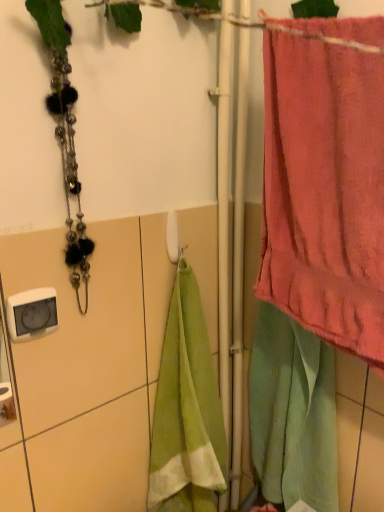
Describe the element at coordinates (173, 238) in the screenshot. This screenshot has height=512, width=384. I see `white plastic towel bar at center` at that location.

Locate an element on the screen. This screenshot has height=512, width=384. white plastic towel bar at center is located at coordinates (173, 238).

What do you see at coordinates (325, 179) in the screenshot? This screenshot has width=384, height=512. I see `pink terry cloth towel at right` at bounding box center [325, 179].

The height and width of the screenshot is (512, 384). Identify the location of pink terry cloth towel at right. (325, 179).

Identify the location of white plastic towel bar at center. (173, 238).

Is pink terry cloth towel at right to the left of white plastic towel bar at center from the viewer's perspective?

Incorrect, pink terry cloth towel at right is not on the left side of white plastic towel bar at center.

Is pink terry cloth towel at right in front of or behind white plastic towel bar at center in the image?

Visually, pink terry cloth towel at right is located in front of white plastic towel bar at center.

Is point (377, 361) positioned after point (177, 239)?

No, (377, 361) is in front of (177, 239).

In the scene shown: From the image's perspective, which object appears higher, pink terry cloth towel at right or white plastic towel bar at center?

pink terry cloth towel at right, from the image's perspective.

From a real-world perspective, is pink terry cloth towel at right located beneath white plastic towel bar at center?

No.

In terms of width, does pink terry cloth towel at right look wider or thinner when compared to white plastic towel bar at center?

pink terry cloth towel at right is wider than white plastic towel bar at center.

From their relative heights in the image, would you say pink terry cloth towel at right is taller or shorter than white plastic towel bar at center?

Considering their sizes, pink terry cloth towel at right has more height than white plastic towel bar at center.

Is pink terry cloth towel at right bigger or smaller than white plastic towel bar at center?

Considering their sizes, pink terry cloth towel at right takes up more space than white plastic towel bar at center.

Is pink terry cloth towel at right positioned beyond the bounds of white plastic towel bar at center?

Indeed, pink terry cloth towel at right is completely outside white plastic towel bar at center.

Is pink terry cloth towel at right placed right next to white plastic towel bar at center?

pink terry cloth towel at right and white plastic towel bar at center are not in contact.

Is pink terry cloth towel at right turned away from white plastic towel bar at center?

No, pink terry cloth towel at right's orientation is not away from white plastic towel bar at center.

How different are the orientations of pink terry cloth towel at right and white plastic towel bar at center in degrees?

90 degrees separate the facing orientations of pink terry cloth towel at right and white plastic towel bar at center.

At what (x,y) coordinates should I click in order to perform the action: click on towel above the white plastic towel bar at center (from the image's perspective). Please return your answer as a coordinate pair (x, y). This screenshot has width=384, height=512. Looking at the image, I should click on (325, 179).

Considering the positions of objects white plastic towel bar at center and pink terry cloth towel at right in the image provided, who is more to the left, white plastic towel bar at center or pink terry cloth towel at right?

From the viewer's perspective, white plastic towel bar at center appears more on the left side.

Does white plastic towel bar at center lie behind pink terry cloth towel at right?

Yes, it is.

Does point (170, 233) lie behind point (283, 36)?

Yes.

From the image's perspective, which is below, white plastic towel bar at center or pink terry cloth towel at right?

white plastic towel bar at center.

From a real-world perspective, is white plastic towel bar at center located higher than pink terry cloth towel at right?

Actually, white plastic towel bar at center is physically below pink terry cloth towel at right in the real world.

Which object is wider, white plastic towel bar at center or pink terry cloth towel at right?

Wider between the two is pink terry cloth towel at right.

In terms of height, does white plastic towel bar at center look taller or shorter compared to pink terry cloth towel at right?

In the image, white plastic towel bar at center appears to be shorter than pink terry cloth towel at right.

Which of these two, white plastic towel bar at center or pink terry cloth towel at right, is bigger?

pink terry cloth towel at right.

Would you say white plastic towel bar at center is inside or outside pink terry cloth towel at right?

white plastic towel bar at center cannot be found inside pink terry cloth towel at right.

Is white plastic towel bar at center not close to pink terry cloth towel at right?

white plastic towel bar at center is actually quite close to pink terry cloth towel at right.

Is white plastic towel bar at center aimed at pink terry cloth towel at right?

Yes, white plastic towel bar at center faces towards pink terry cloth towel at right.

Consider the image. What's the angular difference between white plastic towel bar at center and pink terry cloth towel at right's facing directions?

They differ by 90 degrees in their facing directions.

Locate an element on the screen. This screenshot has width=384, height=512. towel above the white plastic towel bar at center (from the image's perspective) is located at coordinates (325, 179).

Where is `towel bar behind the pink terry cloth towel at right`? Image resolution: width=384 pixels, height=512 pixels. towel bar behind the pink terry cloth towel at right is located at coordinates (173, 238).

There is a white plastic towel bar at center. Identify the location of towel above it (from a real-world perspective). The height and width of the screenshot is (512, 384). (325, 179).